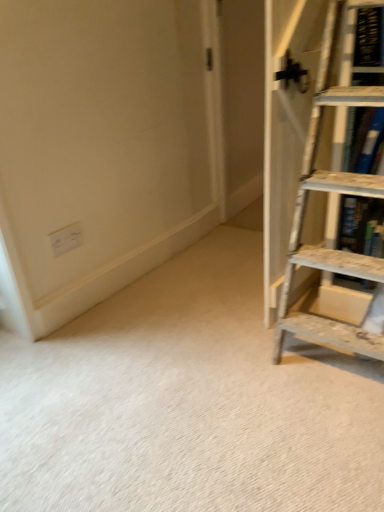
Question: Should I look upward or downward to see white marble shelf at right?

Choices:
 (A) up
 (B) down

Answer: (A)